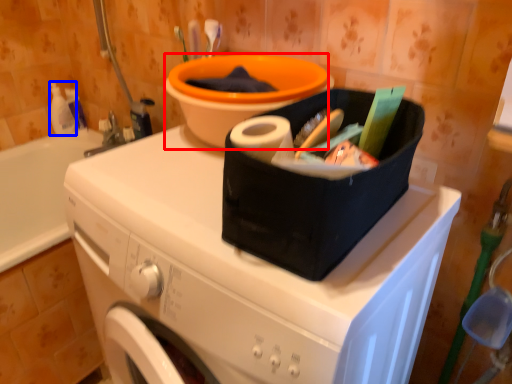
Question: Which of the following is the closest to the observer, basin (highlighted by a red box) or cleaning product (highlighted by a blue box)?

Choices:
 (A) basin
 (B) cleaning product

Answer: (A)